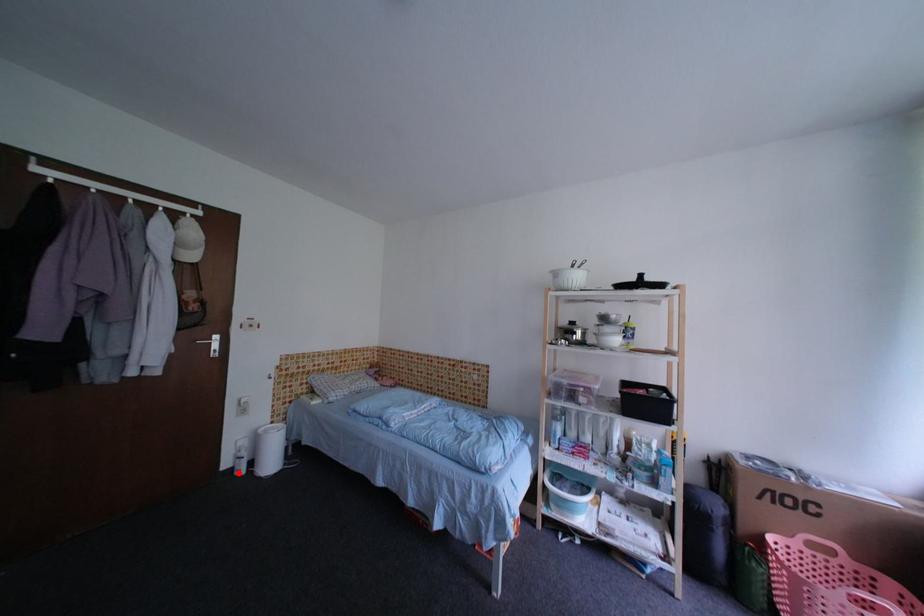
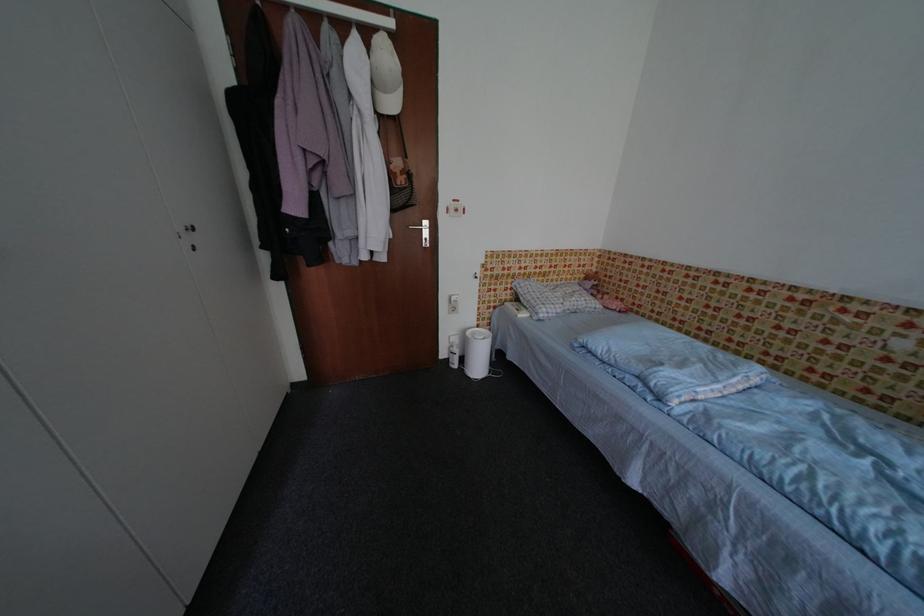
Question: I am providing you with two images of the same scene from different viewpoints. Image1 has a red point marked. In image2, the corresponding 3D location appears at what relative position? Reply with the corresponding letter.

Choices:
 (A) Closer
 (B) Farther

Answer: (B)